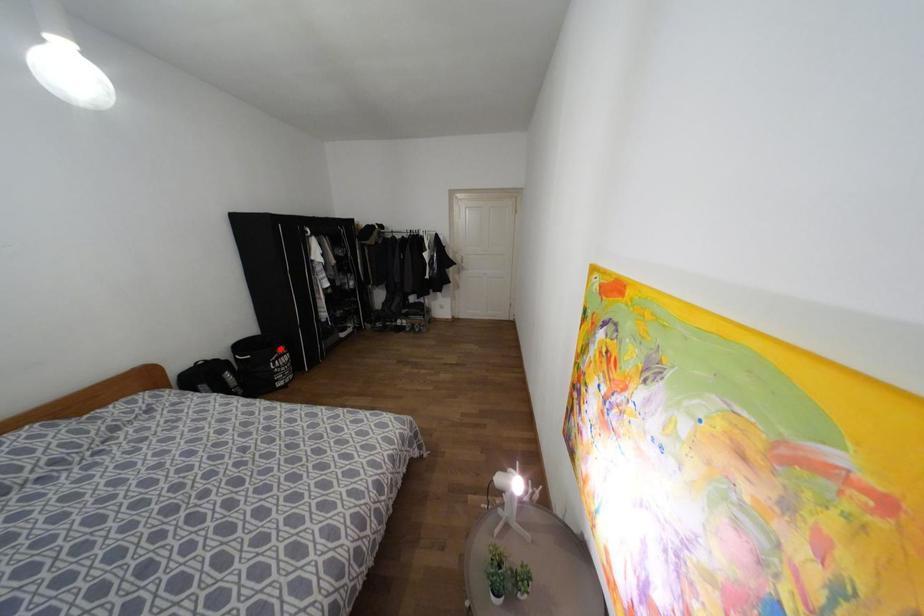
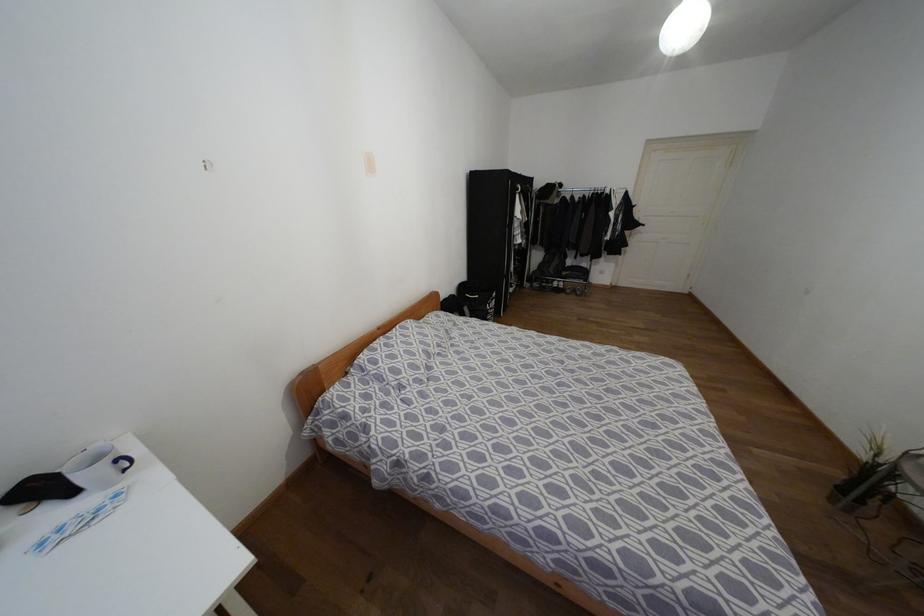
Question: I am providing you with two images of the same scene from different viewpoints. In image1, a red point is highlighted. Considering the same 3D point in image2, which of the following is correct?

Choices:
 (A) It is closer
 (B) It is farther

Answer: (B)